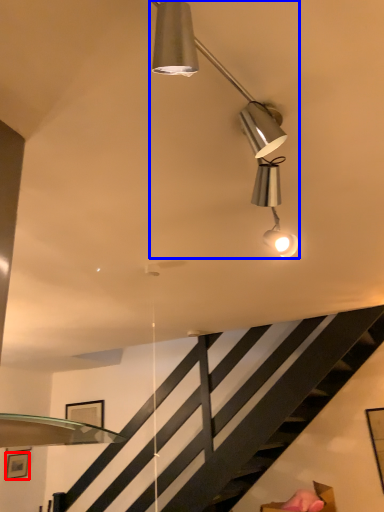
Question: Which of the following is the closest to the observer, picture frame (highlighted by a red box) or lamp (highlighted by a blue box)?

Choices:
 (A) picture frame
 (B) lamp

Answer: (B)